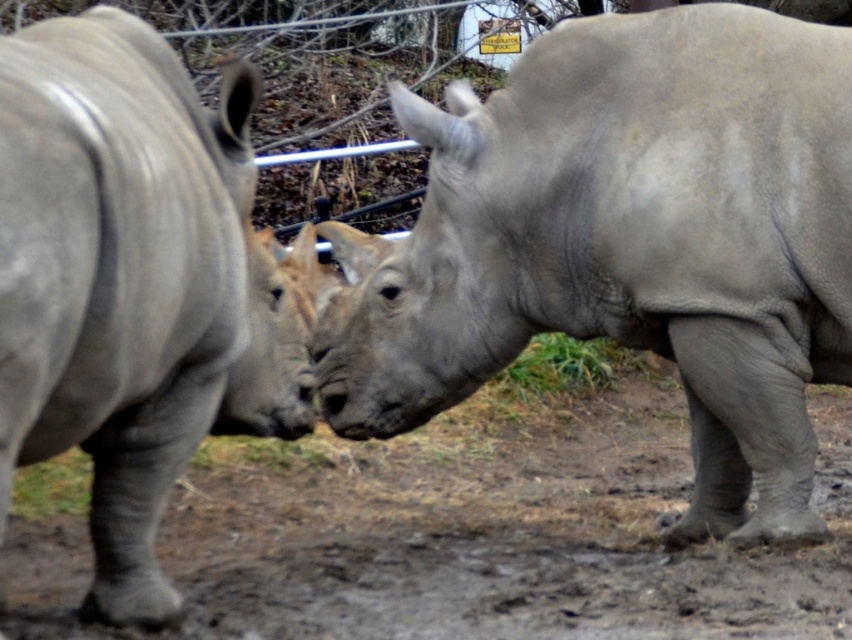
Question: Observing the image, what is the correct spatial positioning of gray matte rhinoceros at center in reference to gray matte rhinoceros at left?

Choices:
 (A) below
 (B) above

Answer: (B)

Question: Among these objects, which one is nearest to the camera?

Choices:
 (A) gray matte rhinoceros at center
 (B) gray matte rhinoceros at left

Answer: (B)

Question: Is gray matte rhinoceros at center below gray matte rhinoceros at left?

Choices:
 (A) no
 (B) yes

Answer: (A)

Question: Can you confirm if gray matte rhinoceros at center is thinner than gray matte rhinoceros at left?

Choices:
 (A) no
 (B) yes

Answer: (A)

Question: Among these objects, which one is nearest to the camera?

Choices:
 (A) gray matte rhinoceros at left
 (B) gray matte rhinoceros at center

Answer: (A)